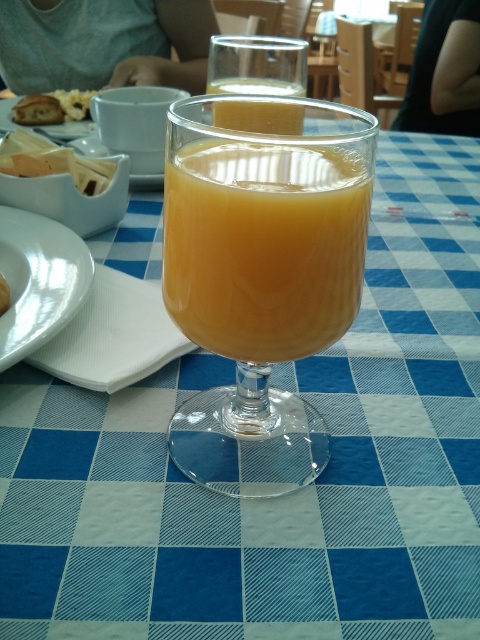
Consider the image. You are a waiter at a restaurant and need to place a new menu on the table. The table has a blue and white checkered tablecloth. Where should you place the menu so it doesn not interfere with the translucent glass at center?

The translucent glass at center is located at point (259, 116). To avoid interference, place the menu away from this coordinate, perhaps to the left or right side of the table.

You are a waiter holding a dessert tray and need to place it on the table without obstructing the glass of orange juice. The dessert tray is 12 inches wide. Can you fit it between the white ceramic plate at lower left and the edge of the table?

The distance of white ceramic plate at lower left from camera is 10.07 inches. Since the dessert tray is 12 inches wide, it is wider than the available space, so it won